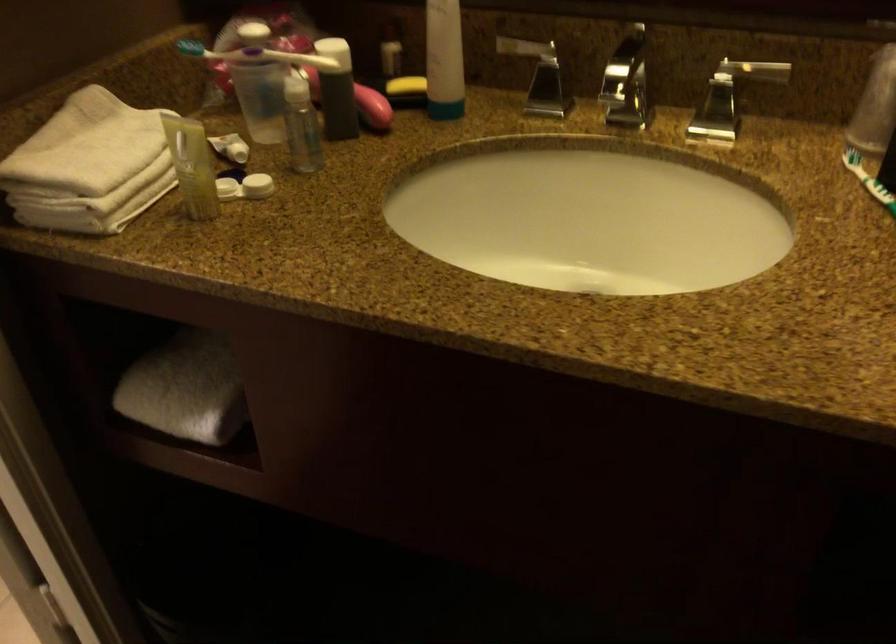
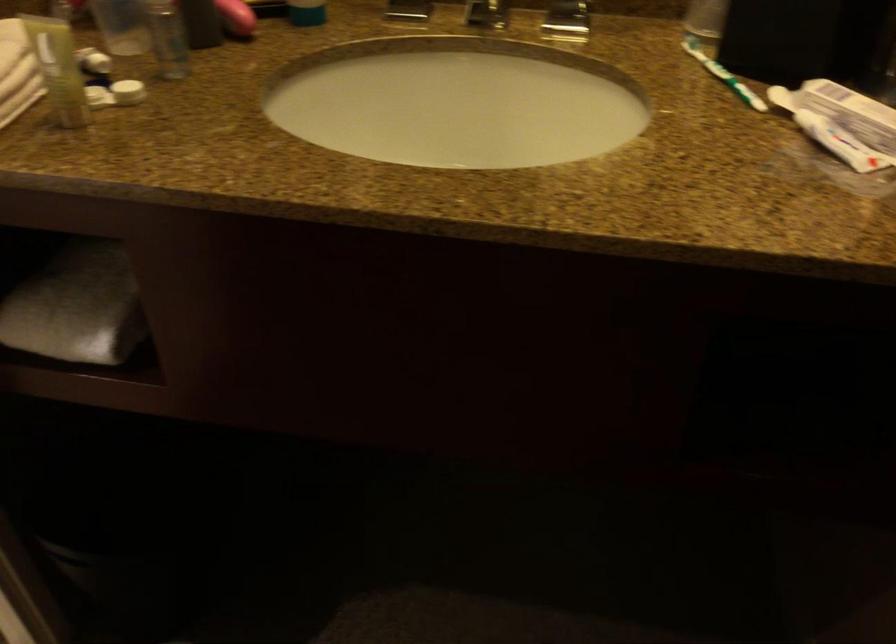
In the second image, find the point that corresponds to pixel 443 107 in the first image.

(306, 13)